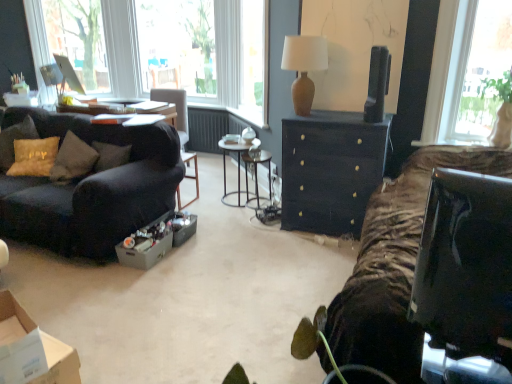
The image size is (512, 384). In order to click on vacant space in metallic silver side table at center (from a real-world perspective) in this screenshot , I will do `click(234, 201)`.